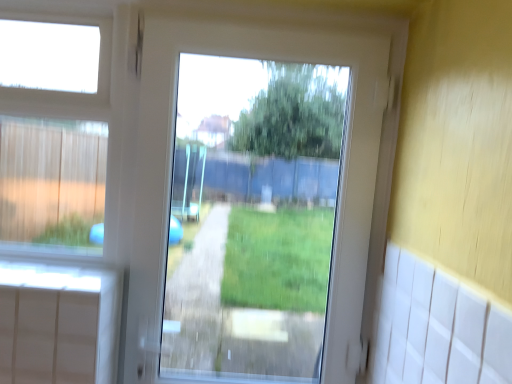
Question: Relative to white plastic window at upper left, is white plastic screen door at center in front or behind?

Choices:
 (A) behind
 (B) front

Answer: (B)

Question: In terms of width, does white plastic screen door at center look wider or thinner when compared to white plastic window at upper left?

Choices:
 (A) wide
 (B) thin

Answer: (A)

Question: From their relative heights in the image, would you say white plastic screen door at center is taller or shorter than white plastic window at upper left?

Choices:
 (A) short
 (B) tall

Answer: (B)

Question: From the image's perspective, is white plastic window at upper left above or below white plastic screen door at center?

Choices:
 (A) below
 (B) above

Answer: (B)

Question: From a real-world perspective, is white plastic window at upper left physically located above or below white plastic screen door at center?

Choices:
 (A) above
 (B) below

Answer: (A)

Question: Considering the positions of white plastic window at upper left and white plastic screen door at center in the image, is white plastic window at upper left wider or thinner than white plastic screen door at center?

Choices:
 (A) wide
 (B) thin

Answer: (B)

Question: Is white plastic window at upper left spatially inside white plastic screen door at center, or outside of it?

Choices:
 (A) outside
 (B) inside

Answer: (A)